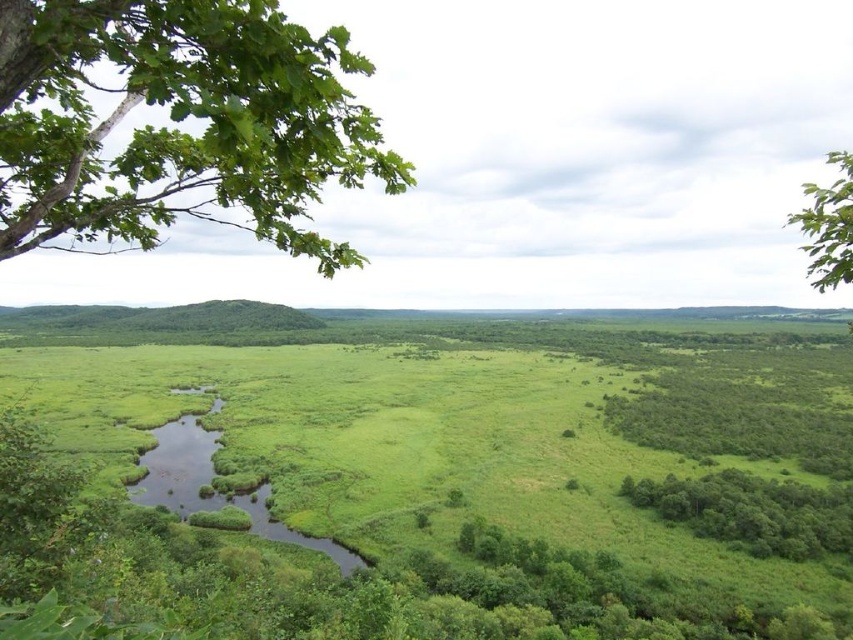
Question: Which object appears farthest from the camera in this image?

Choices:
 (A) green grassy field at center
 (B) green leafy trees at lower right

Answer: (B)

Question: Based on their relative distances, which object is farther from the green leafy tree at upper right?

Choices:
 (A) green leafy trees at lower right
 (B) green grassy field at center
 (C) green leafy branch at upper left

Answer: (C)

Question: Is green grassy field at center closer to camera compared to green leafy trees at lower right?

Choices:
 (A) no
 (B) yes

Answer: (B)

Question: Which point is closer to the camera?

Choices:
 (A) green leafy branch at upper left
 (B) green leafy tree at upper right
 (C) green grassy field at center

Answer: (A)

Question: Does green leafy trees at lower right lie behind green leafy tree at upper right?

Choices:
 (A) yes
 (B) no

Answer: (A)

Question: Is green leafy trees at lower right below green leafy tree at upper right?

Choices:
 (A) no
 (B) yes

Answer: (B)